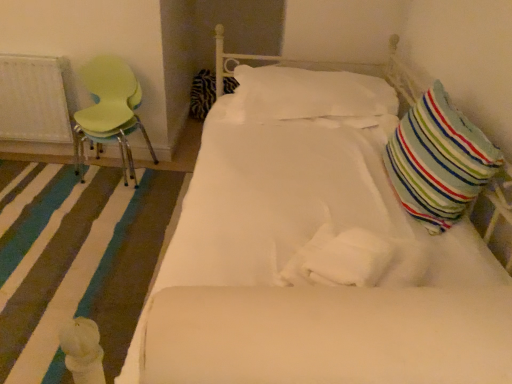
This screenshot has width=512, height=384. In order to click on white textured radiator at left in this screenshot , I will do `click(35, 99)`.

Describe the element at coordinates (439, 161) in the screenshot. I see `striped fabric pillow at right, the 1th pillow from the front` at that location.

I want to click on white fabric rug at lower left, so click(x=76, y=263).

This screenshot has width=512, height=384. I want to click on zebra-patterned fabric pillow at center-left, the third pillow from the front, so click(202, 94).

This screenshot has height=384, width=512. What do you see at coordinates (109, 112) in the screenshot?
I see `light green plastic chair at left` at bounding box center [109, 112].

I want to click on white textured radiator at left, so click(x=35, y=99).

Based on the photo, is striped fabric pillow at right, placed as the 1th pillow when sorted from right to left, facing towards white soft pillow at center, which is the 2th pillow in back-to-front order?

No, striped fabric pillow at right, placed as the 1th pillow when sorted from right to left, is not oriented towards white soft pillow at center, which is the 2th pillow in back-to-front order.

Is striped fabric pillow at right, the 3th pillow when ordered from left to right, thinner than white soft pillow at center, which is the 2th pillow from left to right?

Correct, the width of striped fabric pillow at right, the 3th pillow when ordered from left to right, is less than that of white soft pillow at center, which is the 2th pillow from left to right.

From the picture: From a real-world perspective, is striped fabric pillow at right, placed as the 1th pillow when sorted from right to left, physically below white soft pillow at center, which appears as the 2th pillow when viewed from the front?

No, from a real-world perspective, striped fabric pillow at right, placed as the 1th pillow when sorted from right to left, is not below white soft pillow at center, which appears as the 2th pillow when viewed from the front.

Is zebra-patterned fabric pillow at center-left, placed as the 3th pillow when sorted from right to left, inside the boundaries of light green plastic chair at left, or outside?

zebra-patterned fabric pillow at center-left, placed as the 3th pillow when sorted from right to left, is not enclosed by light green plastic chair at left.

Which of these two, zebra-patterned fabric pillow at center-left, the third pillow from the front, or light green plastic chair at left, is wider?

Wider between the two is zebra-patterned fabric pillow at center-left, the third pillow from the front.

Is zebra-patterned fabric pillow at center-left, the third pillow from the front, oriented towards light green plastic chair at left?

Yes.

Is zebra-patterned fabric pillow at center-left, which ranks as the first pillow in back-to-front order, bigger or smaller than striped fabric pillow at right, the 3th pillow when ordered from left to right?

Considering their sizes, zebra-patterned fabric pillow at center-left, which ranks as the first pillow in back-to-front order, takes up more space than striped fabric pillow at right, the 3th pillow when ordered from left to right.

Which object is closer to the camera taking this photo, zebra-patterned fabric pillow at center-left, placed as the 3th pillow when sorted from right to left, or striped fabric pillow at right, placed as the 1th pillow when sorted from right to left?

Positioned in front is striped fabric pillow at right, placed as the 1th pillow when sorted from right to left.

Do you think zebra-patterned fabric pillow at center-left, the third pillow from the front, is within striped fabric pillow at right, the 3th pillow when ordered from left to right, or outside of it?

zebra-patterned fabric pillow at center-left, the third pillow from the front, is not inside striped fabric pillow at right, the 3th pillow when ordered from left to right, it's outside.

Between striped fabric pillow at right, the 3th pillow when ordered from left to right, and light green plastic chair at left, which one has smaller width?

striped fabric pillow at right, the 3th pillow when ordered from left to right.

Considering the sizes of objects striped fabric pillow at right, the 3th pillow when ordered from left to right, and light green plastic chair at left in the image provided, who is shorter, striped fabric pillow at right, the 3th pillow when ordered from left to right, or light green plastic chair at left?

With less height is striped fabric pillow at right, the 3th pillow when ordered from left to right.

Who is bigger, striped fabric pillow at right, placed as the 1th pillow when sorted from right to left, or light green plastic chair at left?

light green plastic chair at left.

From the image's perspective, who appears lower, striped fabric pillow at right, the third pillow positioned from the back, or light green plastic chair at left?

striped fabric pillow at right, the third pillow positioned from the back, is shown below in the image.

Which point is more distant from viewer, (475, 161) or (229, 85)?

The point (229, 85) is behind.

Based on their sizes in the image, would you say striped fabric pillow at right, the 3th pillow when ordered from left to right, is bigger or smaller than zebra-patterned fabric pillow at center-left, which ranks as the first pillow in back-to-front order?

striped fabric pillow at right, the 3th pillow when ordered from left to right, is smaller than zebra-patterned fabric pillow at center-left, which ranks as the first pillow in back-to-front order.

From the image's perspective, is striped fabric pillow at right, the 3th pillow when ordered from left to right, under zebra-patterned fabric pillow at center-left, which is counted as the first pillow, starting from the left?

Correct, striped fabric pillow at right, the 3th pillow when ordered from left to right, appears lower than zebra-patterned fabric pillow at center-left, which is counted as the first pillow, starting from the left, in the image.

Is striped fabric pillow at right, the third pillow positioned from the back, surrounding zebra-patterned fabric pillow at center-left, placed as the 3th pillow when sorted from right to left?

No, zebra-patterned fabric pillow at center-left, placed as the 3th pillow when sorted from right to left, is not a part of striped fabric pillow at right, the third pillow positioned from the back.

Considering the positions of objects white fabric rug at lower left and white soft pillow at center, which is the 2th pillow in back-to-front order, in the image provided, who is more to the right, white fabric rug at lower left or white soft pillow at center, which is the 2th pillow in back-to-front order,?

Positioned to the right is white soft pillow at center, which is the 2th pillow in back-to-front order.

Can you confirm if white fabric rug at lower left is smaller than white soft pillow at center, which is the 2th pillow in back-to-front order?

Indeed, white fabric rug at lower left has a smaller size compared to white soft pillow at center, which is the 2th pillow in back-to-front order.

Which object is further away from the camera taking this photo, white fabric rug at lower left or white soft pillow at center, which appears as the 2th pillow when viewed from the front?

white soft pillow at center, which appears as the 2th pillow when viewed from the front, is more distant.

Identify the location of strip below the white textured radiator at left (from a real-world perspective). This screenshot has height=384, width=512. (76, 263).

Is there a large distance between white fabric rug at lower left and white textured radiator at left?

white fabric rug at lower left is actually quite close to white textured radiator at left.

Would you say white fabric rug at lower left is to the left or to the right of white textured radiator at left in the picture?

white fabric rug at lower left is positioned on white textured radiator at left's right side.

At what (x,y) coordinates should I click in order to perform the action: click on pillow located above the white soft pillow at center, which is the 2th pillow in back-to-front order (from a real-world perspective). Please return your answer as a coordinate pair (x, y). The width and height of the screenshot is (512, 384). Looking at the image, I should click on (439, 161).

The image size is (512, 384). I want to click on pillow below the light green plastic chair at left (from a real-world perspective), so click(202, 94).

Estimate the real-world distances between objects in this image. Which object is closer to striped fabric pillow at right, the third pillow positioned from the back, white fabric rug at lower left or white textured radiator at left?

white fabric rug at lower left is positioned closer to the anchor striped fabric pillow at right, the third pillow positioned from the back.

Which object lies nearer to the anchor point light green plastic chair at left, white soft pillow at center, which appears as the 2th pillow when viewed from the front, or white fabric rug at lower left?

Among the two, white fabric rug at lower left is located nearer to light green plastic chair at left.

Considering their positions, is white textured radiator at left positioned closer to zebra-patterned fabric pillow at center-left, placed as the 3th pillow when sorted from right to left, than white fabric rug at lower left?

Among the two, white textured radiator at left is located nearer to zebra-patterned fabric pillow at center-left, placed as the 3th pillow when sorted from right to left.

Considering their positions, is white textured radiator at left positioned further to white soft pillow at center, which appears as the 2th pillow when viewed from the front, than striped fabric pillow at right, the 3th pillow when ordered from left to right?

white textured radiator at left lies further to white soft pillow at center, which appears as the 2th pillow when viewed from the front, than the other object.

From the image, which object appears to be nearer to zebra-patterned fabric pillow at center-left, which is counted as the first pillow, starting from the left, white fabric rug at lower left or white soft pillow at center, the 2th pillow positioned from the right?

white soft pillow at center, the 2th pillow positioned from the right.

Based on their spatial positions, is white textured radiator at left or light green plastic chair at left further from white fabric rug at lower left?

Based on the image, white textured radiator at left appears to be further to white fabric rug at lower left.

Estimate the real-world distances between objects in this image. Which object is further from zebra-patterned fabric pillow at center-left, which is counted as the first pillow, starting from the left, white soft pillow at center, which is the 2th pillow in back-to-front order, or striped fabric pillow at right, the 3th pillow when ordered from left to right?

The object further to zebra-patterned fabric pillow at center-left, which is counted as the first pillow, starting from the left, is striped fabric pillow at right, the 3th pillow when ordered from left to right.

Looking at the image, which one is located closer to white soft pillow at center, which is the 2th pillow from left to right, white textured radiator at left or zebra-patterned fabric pillow at center-left, which is counted as the first pillow, starting from the left?

white textured radiator at left is closer to white soft pillow at center, which is the 2th pillow from left to right.

The height and width of the screenshot is (384, 512). In order to click on chair situated between white fabric rug at lower left and white soft pillow at center, the 2th pillow positioned from the right, from left to right in this screenshot , I will do `click(109, 112)`.

The image size is (512, 384). In order to click on chair positioned between white fabric rug at lower left and white textured radiator at left from near to far in this screenshot , I will do `click(109, 112)`.

You are a GUI agent. You are given a task and a screenshot of the screen. Output one action in this format:
    pyautogui.click(x=<x>, y=<y>)
    Task: Click on the chair positioned between white soft pillow at center, the 2th pillow positioned from the right, and zebra-patterned fabric pillow at center-left, which ranks as the first pillow in back-to-front order, from near to far
    This screenshot has height=384, width=512.
    Given the screenshot: What is the action you would take?
    pyautogui.click(x=109, y=112)

This screenshot has width=512, height=384. I want to click on pillow between white textured radiator at left and white soft pillow at center, which is the 2th pillow from left to right, so click(202, 94).